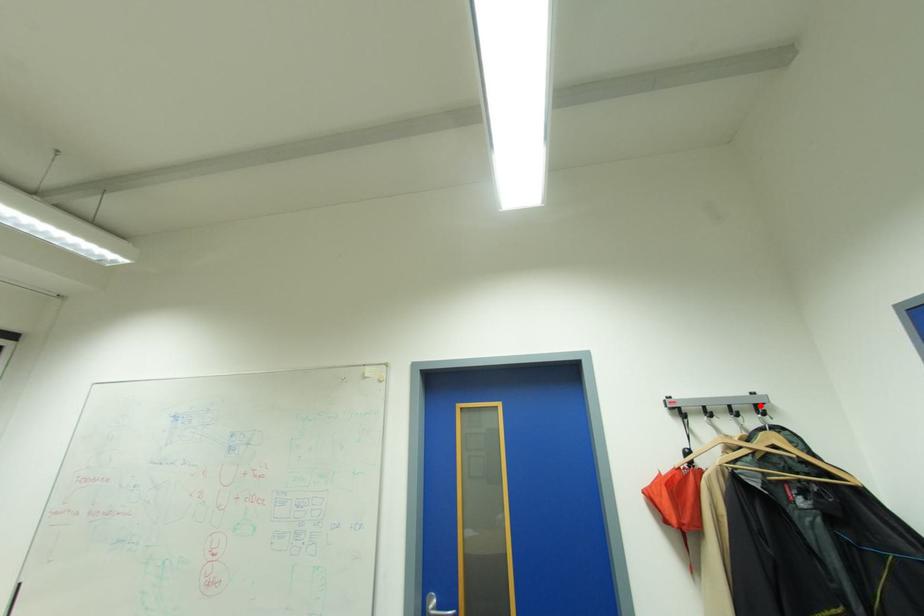
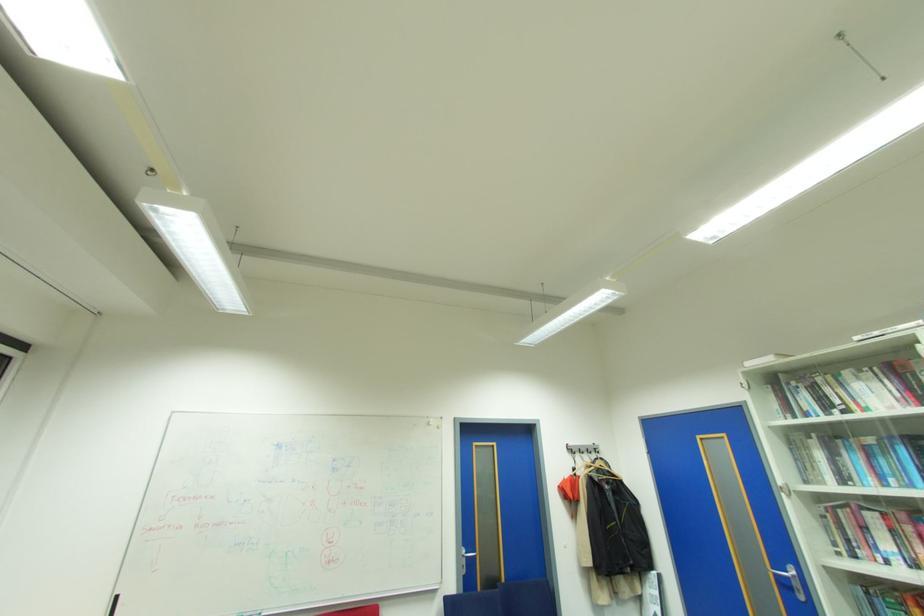
Locate, in the second image, the point that corresponds to the highlighted location in the first image.

(600, 448)